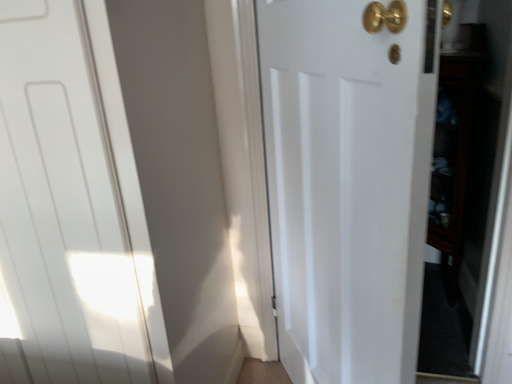
Question: Based on their positions, is white matte door at center, which ranks as the 2th door in left-to-right order, located to the left or right of white matte door at left, which is the first door from left to right?

Choices:
 (A) right
 (B) left

Answer: (A)

Question: Is point (396, 74) closer or farther from the camera than point (44, 77)?

Choices:
 (A) closer
 (B) farther

Answer: (A)

Question: Which of these objects is positioned closest to the white matte door at center, which ranks as the 2th door in left-to-right order?

Choices:
 (A) dark wood cabinet at right
 (B) white matte door at left, which is the first door from left to right

Answer: (B)

Question: Which is nearer to the white matte door at center, which ranks as the 2th door in left-to-right order?

Choices:
 (A) white matte door at left, which is the first door from left to right
 (B) dark wood cabinet at right

Answer: (A)